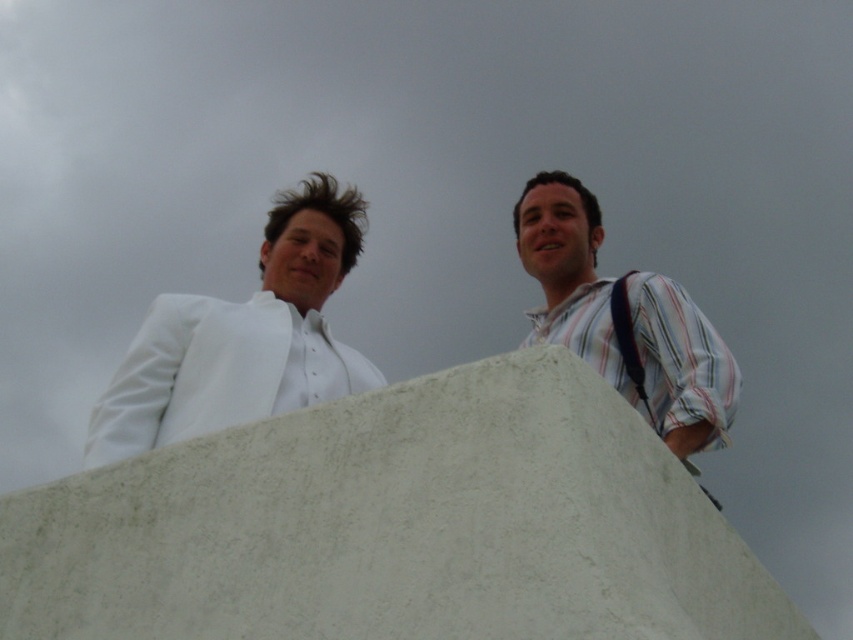
You are standing at the base of the large concrete structure in the foreground. You want to reach the point marked at coordinates (534, 228). Given that the point is 72.74 meters away from your current position, can you estimate how far you need to walk to reach it?

The point at coordinates (534, 228) is 72.74 meters away from your current position, so you need to walk approximately 72.74 meters to reach it.

You are a photographer adjusting your camera settings to focus on both the striped cotton shirt at upper right and the black fabric strap at right. Since the camera can only focus on one plane at a time, which object should you prioritize focusing on to ensure the other is also in acceptable focus?

You should prioritize focusing on the striped cotton shirt at upper right because it is in front of the black fabric strap at right. By focusing on the closer object, the background object will still be within the depth of field and appear acceptably sharp.